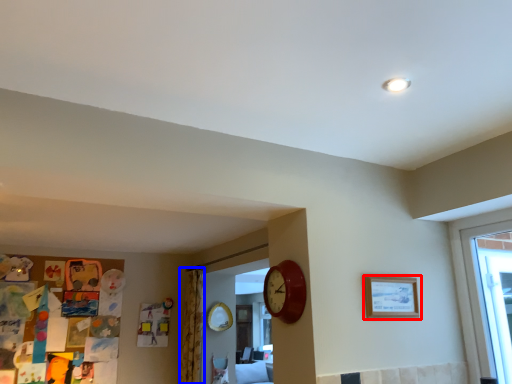
Question: Among these objects, which one is farthest to the camera, picture frame (highlighted by a red box) or curtain (highlighted by a blue box)?

Choices:
 (A) picture frame
 (B) curtain

Answer: (B)